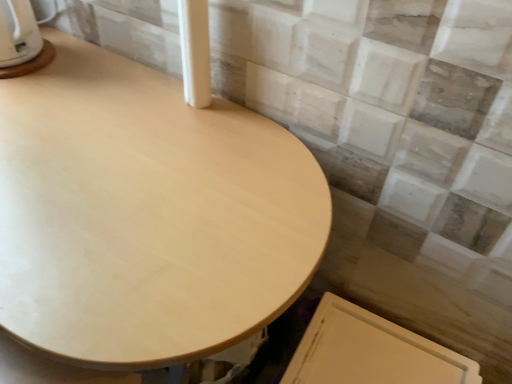
Question: Can you confirm if white smooth pillar at upper center is taller than white glossy kettle at upper left?

Choices:
 (A) no
 (B) yes

Answer: (B)

Question: From the image's perspective, does white smooth pillar at upper center appear higher than white glossy kettle at upper left?

Choices:
 (A) no
 (B) yes

Answer: (A)

Question: Could you tell me if white smooth pillar at upper center is turned towards white glossy kettle at upper left?

Choices:
 (A) yes
 (B) no

Answer: (B)

Question: Is the depth of white smooth pillar at upper center greater than that of white glossy kettle at upper left?

Choices:
 (A) no
 (B) yes

Answer: (A)

Question: Can you confirm if white smooth pillar at upper center is shorter than white glossy kettle at upper left?

Choices:
 (A) yes
 (B) no

Answer: (B)

Question: Are white smooth pillar at upper center and white glossy kettle at upper left beside each other?

Choices:
 (A) no
 (B) yes

Answer: (A)

Question: Is light wood table at center positioned beyond the bounds of white smooth pillar at upper center?

Choices:
 (A) no
 (B) yes

Answer: (B)

Question: From a real-world perspective, is light wood table at center positioned over white smooth pillar at upper center based on gravity?

Choices:
 (A) no
 (B) yes

Answer: (A)

Question: Is light wood table at center to the left of white smooth pillar at upper center from the viewer's perspective?

Choices:
 (A) yes
 (B) no

Answer: (A)

Question: Does light wood table at center have a larger size compared to white smooth pillar at upper center?

Choices:
 (A) yes
 (B) no

Answer: (A)

Question: Is light wood table at center positioned in front of white smooth pillar at upper center?

Choices:
 (A) yes
 (B) no

Answer: (A)

Question: Can you confirm if light wood table at center is wider than white smooth pillar at upper center?

Choices:
 (A) no
 (B) yes

Answer: (B)

Question: Is light wood table at center looking in the opposite direction of white glossy kettle at upper left?

Choices:
 (A) yes
 (B) no

Answer: (B)